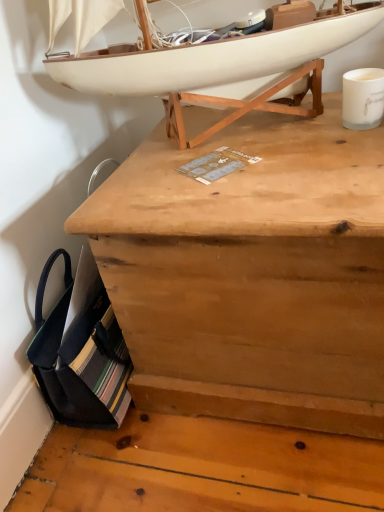
Question: Is white matte coffee cup at upper right at the right side of natural wood chest at center?

Choices:
 (A) no
 (B) yes

Answer: (B)

Question: Does white matte coffee cup at upper right have a smaller size compared to natural wood chest at center?

Choices:
 (A) yes
 (B) no

Answer: (A)

Question: From the image's perspective, is white matte coffee cup at upper right beneath natural wood chest at center?

Choices:
 (A) no
 (B) yes

Answer: (A)

Question: Is white matte coffee cup at upper right oriented away from natural wood chest at center?

Choices:
 (A) no
 (B) yes

Answer: (A)

Question: Is white matte coffee cup at upper right taller than natural wood chest at center?

Choices:
 (A) yes
 (B) no

Answer: (B)

Question: Is white matte coffee cup at upper right behind natural wood chest at center?

Choices:
 (A) no
 (B) yes

Answer: (B)

Question: Is the position of natural wood chest at center less distant than that of white matte boat at upper center?

Choices:
 (A) yes
 (B) no

Answer: (A)

Question: Can you confirm if natural wood chest at center is positioned to the right of white matte boat at upper center?

Choices:
 (A) no
 (B) yes

Answer: (B)

Question: Is natural wood chest at center aimed at white matte boat at upper center?

Choices:
 (A) yes
 (B) no

Answer: (B)

Question: From a real-world perspective, is natural wood chest at center physically above white matte boat at upper center?

Choices:
 (A) yes
 (B) no

Answer: (B)

Question: Is natural wood chest at center at the left side of white matte boat at upper center?

Choices:
 (A) no
 (B) yes

Answer: (A)

Question: Is natural wood chest at center located outside white matte boat at upper center?

Choices:
 (A) yes
 (B) no

Answer: (A)

Question: Is natural wood chest at center next to white matte coffee cup at upper right and touching it?

Choices:
 (A) yes
 (B) no

Answer: (B)